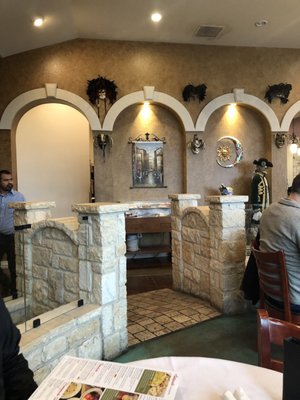
In order to click on ceiling in this screenshot , I will do `click(180, 20)`.